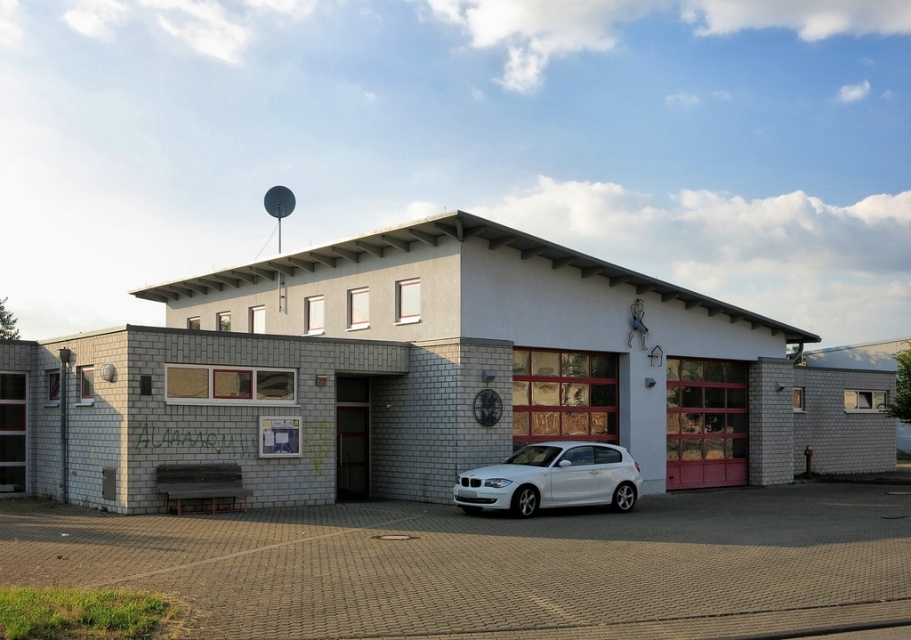
Which is behind, point (642, 284) or point (464, 502)?

Point (642, 284)

Which is below, white brick fire station at center or white glossy hatchback at center?

Positioned lower is white glossy hatchback at center.

Who is more distant from viewer, (43,378) or (524,465)?

Positioned behind is point (43,378).

Image resolution: width=911 pixels, height=640 pixels. Identify the location of white brick fire station at center. (423, 378).